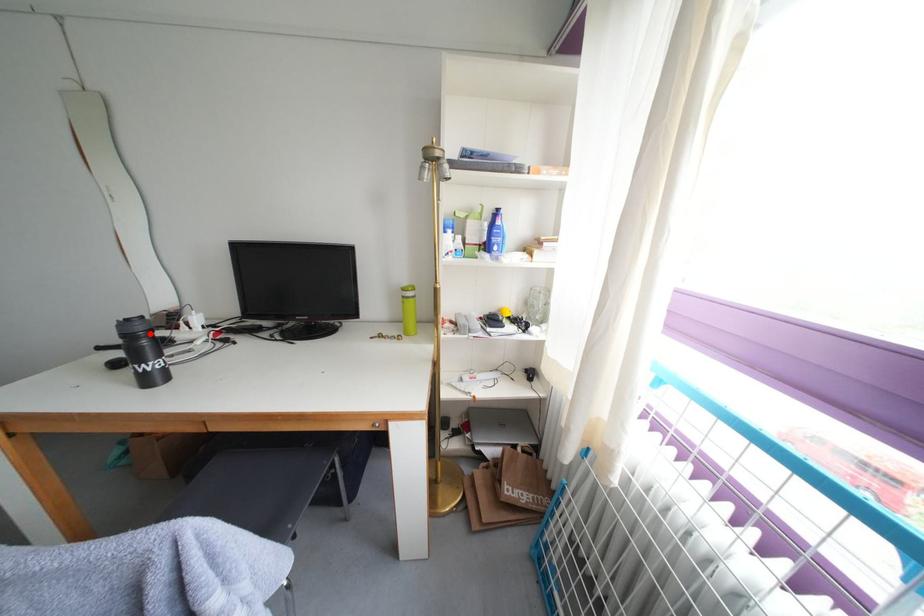
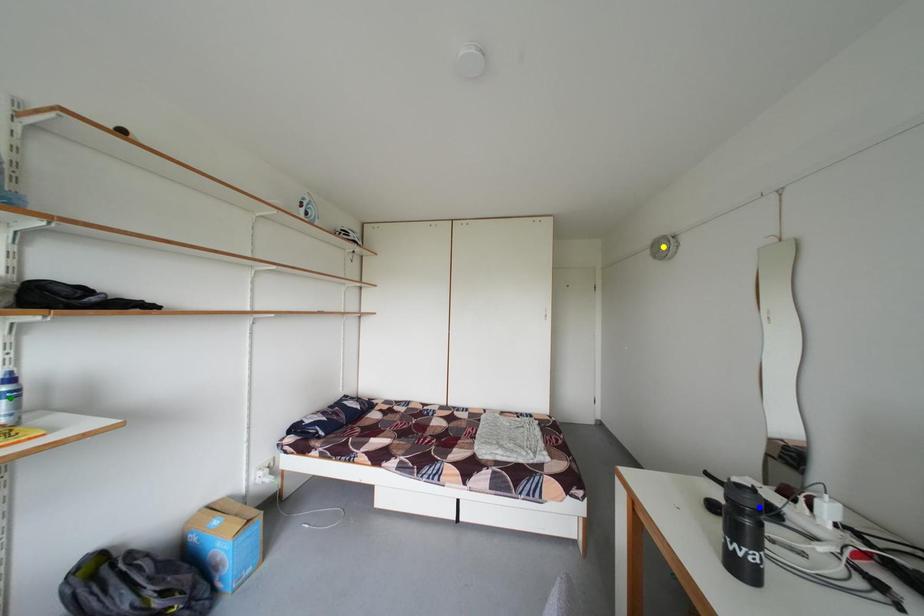
Question: I am providing you with two images of the same scene from different viewpoints. A red point is marked on the first image. You are given multiple points on the second image. Can you choose the point in image 2 that corresponds to the point in image 1?

Choices:
 (A) blue point
 (B) yellow point
 (C) green point

Answer: (A)